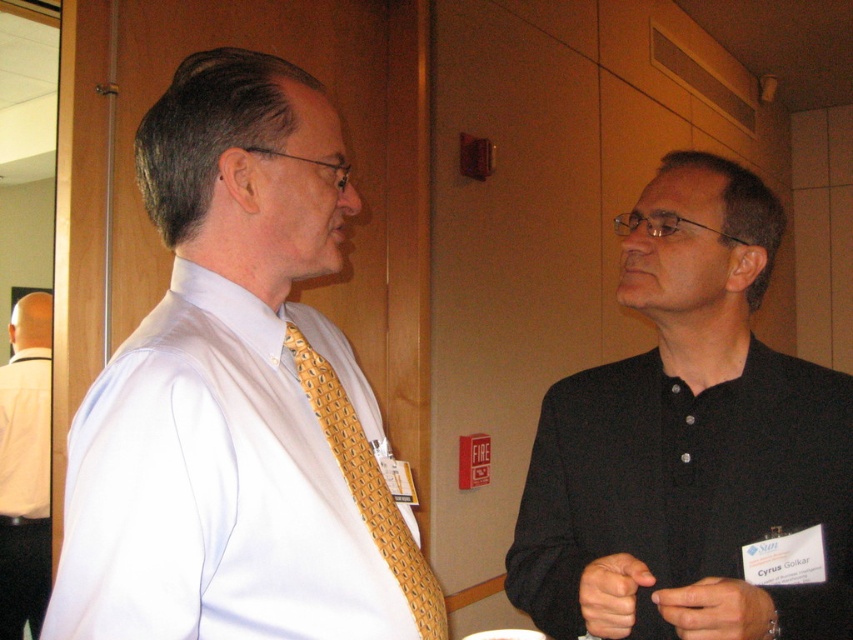
You are organizing a clothing donation drive and need to categorize shirts by size. You have a black matte shirt at right and a white shirt at left. Which shirt has a larger width?

The black matte shirt at right has a larger width than the white shirt at left according to the description.

You are standing at the center of the room and want to move towards the white smooth dress shirt at left. Which direction should you move in?

Since the white smooth dress shirt at left is located at point 0.622 on the x axis and 0.280 on the y axis, you should move towards the left and slightly forward to reach it.

You are standing in a room where two people are talking. You see a black matte shirt at right and a white shirt at left. Which shirt is higher up in the image?

The black matte shirt at right is above the white shirt at left.